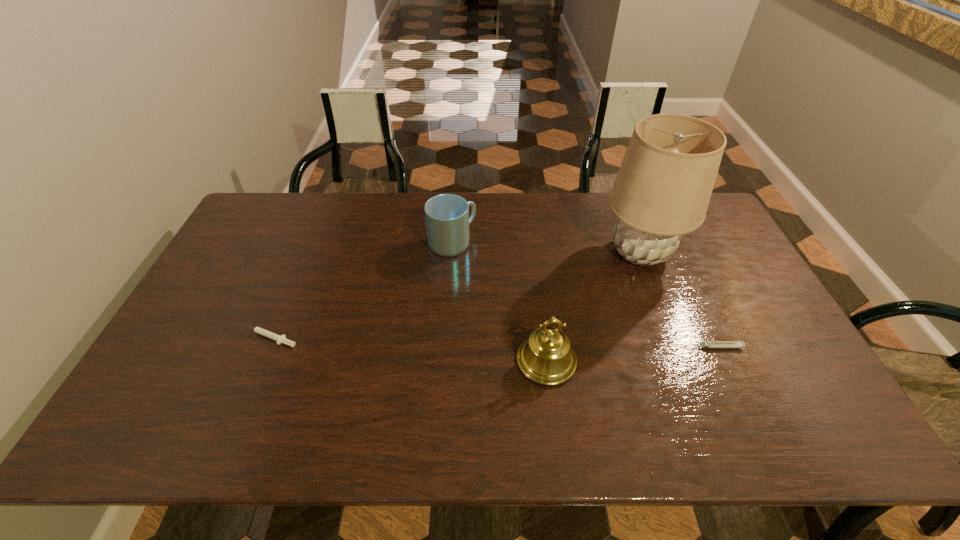
This screenshot has height=540, width=960. What are the coordinates of `object that stands as the third closest to the leftmost object` in the screenshot? It's located at (662, 190).

Locate which object ranks fourth in proximity to the right syringe. Please provide its 2D coordinates. Your answer should be formatted as a tuple, i.e. [(x, y)], where the tuple contains the x and y coordinates of a point satisfying the conditions above.

[(280, 339)]

Identify the location of blank space that satisfies the following two spatial constraints: 1. on the front side of the leftmost object; 2. on the right side of the third object from right to left. The width and height of the screenshot is (960, 540). (259, 361).

Locate an element on the screen. The image size is (960, 540). free region that satisfies the following two spatial constraints: 1. on the front side of the bell; 2. on the right side of the mug is located at coordinates (444, 361).